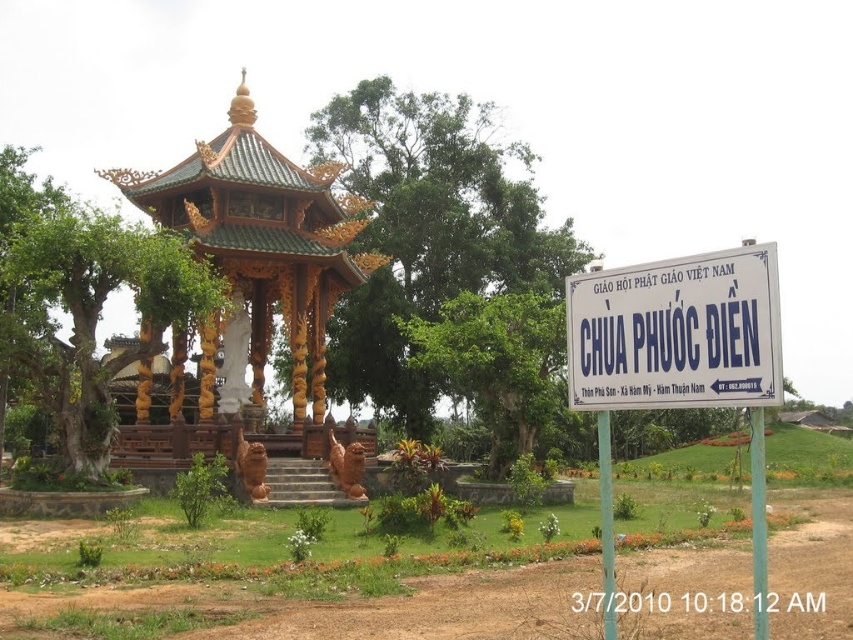
You are a visitor at Chua Phuoc Dien Pagoda. You see a golden wood gazebo at center and a white plastic sign at center. Which object is wider?

The golden wood gazebo at center is wider than the white plastic sign at center.

You are a visitor at Chua Phuoc Dien pagoda and you see the golden wood gazebo at center and the white plastic sign at center. Which one is located to the left side from your perspective?

The golden wood gazebo at center is located to the left of the white plastic sign at center.